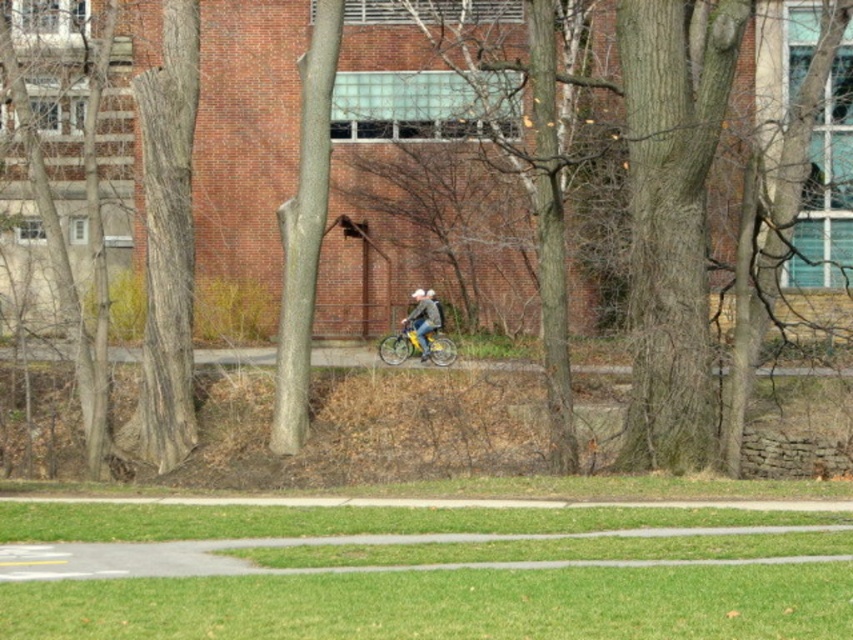
Question: Is yellow matte bicycle at center thinner than denim jacket at center?

Choices:
 (A) yes
 (B) no

Answer: (B)

Question: From the image, what is the correct spatial relationship of yellow matte bicycle at center in relation to denim jacket at center?

Choices:
 (A) right
 (B) left

Answer: (A)

Question: From the image, what is the correct spatial relationship of yellow matte bicycle at center in relation to denim jacket at center?

Choices:
 (A) right
 (B) left

Answer: (A)

Question: Which object is farther from the camera taking this photo?

Choices:
 (A) denim jacket at center
 (B) yellow matte bicycle at center

Answer: (A)